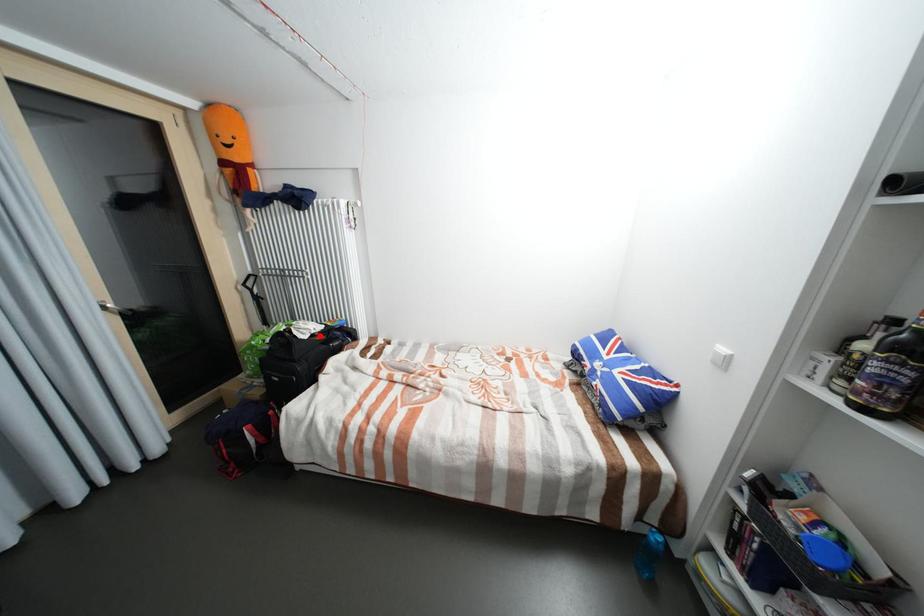
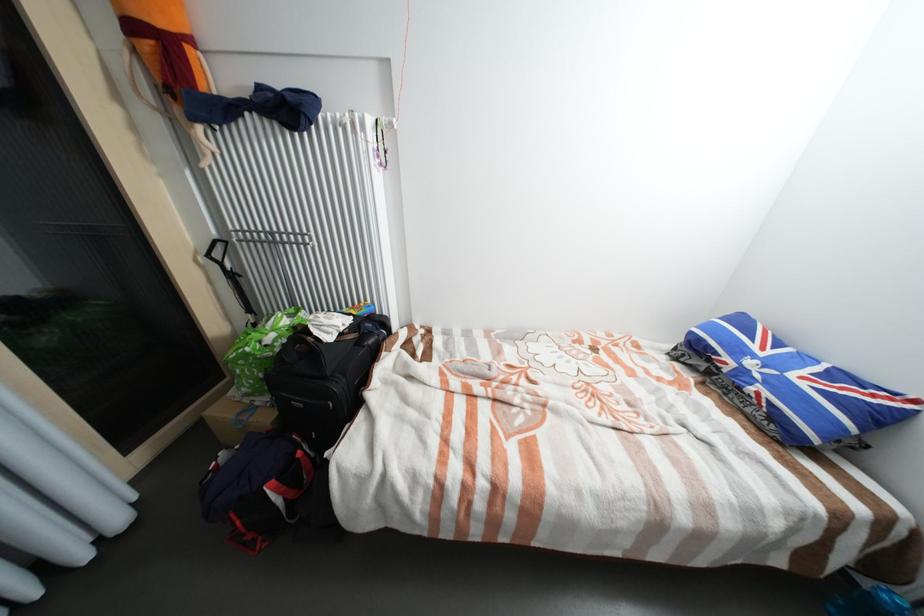
In the second image, find the point that corresponds to the highlighted location in the first image.

(348, 334)